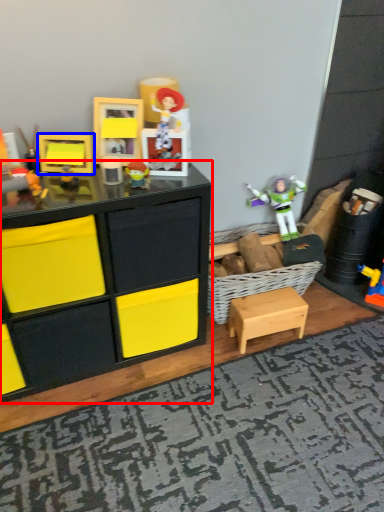
Question: Among these objects, which one is nearest to the camera, chest of drawers (highlighted by a red box) or toy (highlighted by a blue box)?

Choices:
 (A) chest of drawers
 (B) toy

Answer: (A)